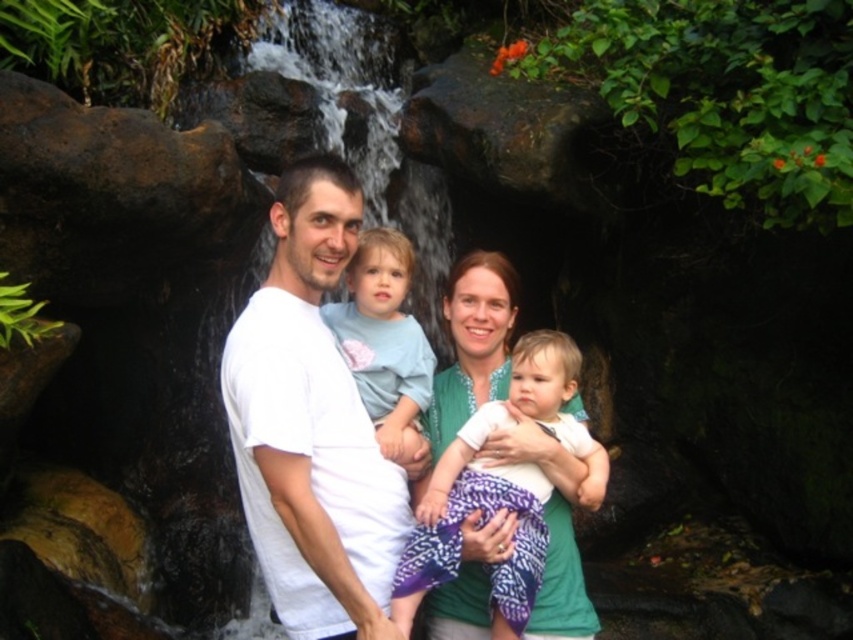
Question: Which of these objects is positioned closest to the green textured dress at center?

Choices:
 (A) light blue cotton shirt at center
 (B) white cotton shirt at center

Answer: (A)

Question: Which point is closer to the camera taking this photo?

Choices:
 (A) pyautogui.click(x=402, y=416)
 (B) pyautogui.click(x=448, y=304)

Answer: (A)

Question: Is green textured dress at center bigger than light blue cotton shirt at center?

Choices:
 (A) yes
 (B) no

Answer: (A)

Question: Which object is farther from the camera taking this photo?

Choices:
 (A) white cotton shirt at center
 (B) light blue cotton shirt at center

Answer: (B)

Question: Is green textured dress at center below light blue cotton shirt at center?

Choices:
 (A) no
 (B) yes

Answer: (B)

Question: Is white cotton shirt at center positioned behind light blue cotton shirt at center?

Choices:
 (A) yes
 (B) no

Answer: (B)